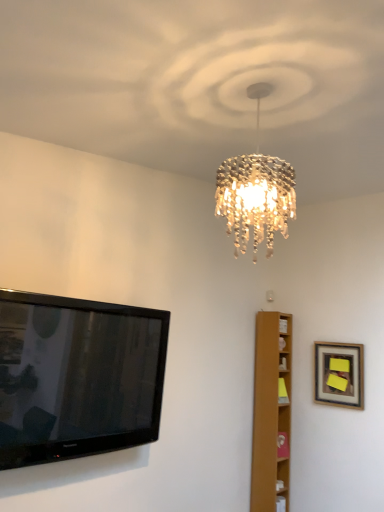
Question: In terms of height, does light brown wooden bookshelf at right look taller or shorter compared to wooden framed picture at upper right?

Choices:
 (A) short
 (B) tall

Answer: (B)

Question: Is light brown wooden bookshelf at right inside the boundaries of wooden framed picture at upper right, or outside?

Choices:
 (A) inside
 (B) outside

Answer: (B)

Question: Which of these objects is positioned closest to the light brown wooden bookshelf at right?

Choices:
 (A) wooden framed picture at upper right
 (B) black glossy flat-screen tv at left

Answer: (A)

Question: Considering the real-world distances, which object is closest to the wooden framed picture at upper right?

Choices:
 (A) light brown wooden bookshelf at right
 (B) black glossy flat-screen tv at left

Answer: (A)